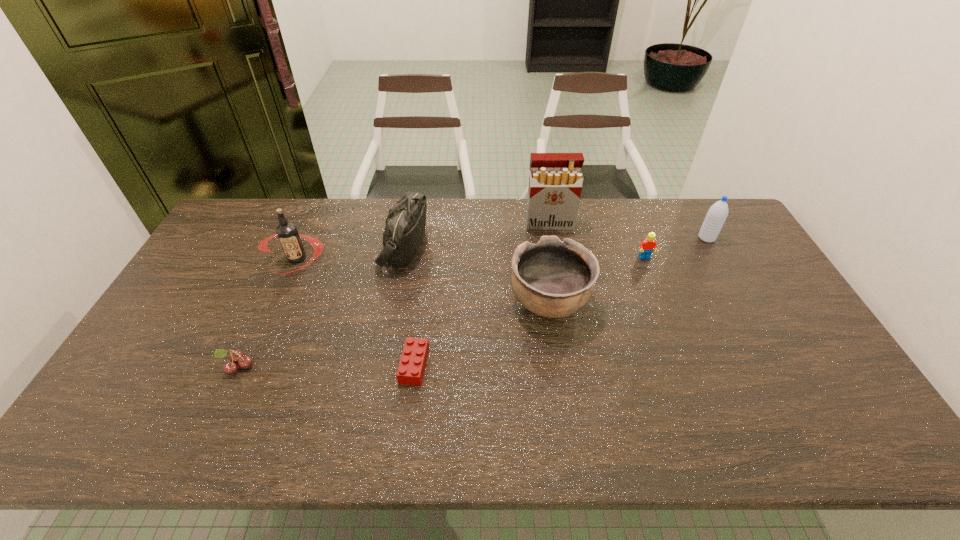
The image size is (960, 540). I want to click on the tallest object, so click(555, 182).

The height and width of the screenshot is (540, 960). Identify the location of shoulder bag. (405, 224).

Identify the location of root beer. The image size is (960, 540). (287, 232).

This screenshot has height=540, width=960. I want to click on the rightmost object, so click(x=717, y=214).

Find the location of a particular element. pottery is located at coordinates (554, 279).

At what (x,y) coordinates should I click in order to perform the action: click on the third shortest object. Please return your answer as a coordinate pair (x, y). The image size is (960, 540). Looking at the image, I should click on (647, 246).

The width and height of the screenshot is (960, 540). I want to click on the right Lego, so click(647, 246).

At what (x,y) coordinates should I click in order to perform the action: click on cherry. Please return your answer as a coordinate pair (x, y). The width and height of the screenshot is (960, 540). Looking at the image, I should click on (244, 362).

In order to click on the shorter Lego in this screenshot , I will do `click(411, 368)`.

I want to click on the nearer Lego, so click(x=411, y=368).